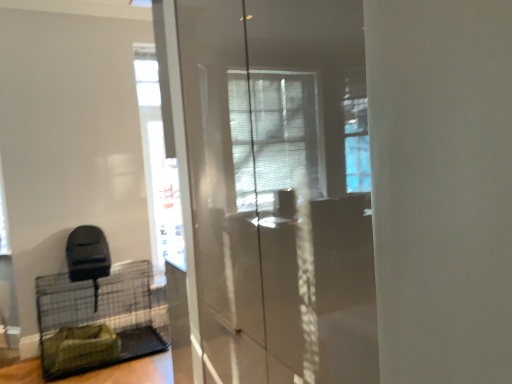
Question: Can you confirm if transparent glass screen door at center is smaller than green fabric birdcage at lower left?

Choices:
 (A) no
 (B) yes

Answer: (B)

Question: Is transparent glass screen door at center not near green fabric birdcage at lower left?

Choices:
 (A) no
 (B) yes

Answer: (B)

Question: From the image's perspective, is transparent glass screen door at center below green fabric birdcage at lower left?

Choices:
 (A) yes
 (B) no

Answer: (B)

Question: Considering the relative sizes of transparent glass screen door at center and green fabric birdcage at lower left in the image provided, is transparent glass screen door at center wider than green fabric birdcage at lower left?

Choices:
 (A) no
 (B) yes

Answer: (A)

Question: From the image's perspective, is transparent glass screen door at center on top of green fabric birdcage at lower left?

Choices:
 (A) yes
 (B) no

Answer: (A)

Question: Considering the relative sizes of transparent glass screen door at center and green fabric birdcage at lower left in the image provided, is transparent glass screen door at center bigger than green fabric birdcage at lower left?

Choices:
 (A) yes
 (B) no

Answer: (B)

Question: Is the position of green fabric birdcage at lower left more distant than that of transparent glass screen door at center?

Choices:
 (A) no
 (B) yes

Answer: (B)

Question: From a real-world perspective, does green fabric birdcage at lower left stand above transparent glass screen door at center?

Choices:
 (A) yes
 (B) no

Answer: (B)

Question: Is green fabric birdcage at lower left directly adjacent to transparent glass screen door at center?

Choices:
 (A) yes
 (B) no

Answer: (B)

Question: Would you say transparent glass screen door at center is part of green fabric birdcage at lower left's contents?

Choices:
 (A) no
 (B) yes

Answer: (A)

Question: Is green fabric birdcage at lower left wider than transparent glass screen door at center?

Choices:
 (A) no
 (B) yes

Answer: (B)

Question: Does green fabric birdcage at lower left appear on the right side of transparent glass screen door at center?

Choices:
 (A) no
 (B) yes

Answer: (A)

Question: Based on their sizes in the image, would you say transparent glass screen door at center is bigger or smaller than green fabric birdcage at lower left?

Choices:
 (A) big
 (B) small

Answer: (B)